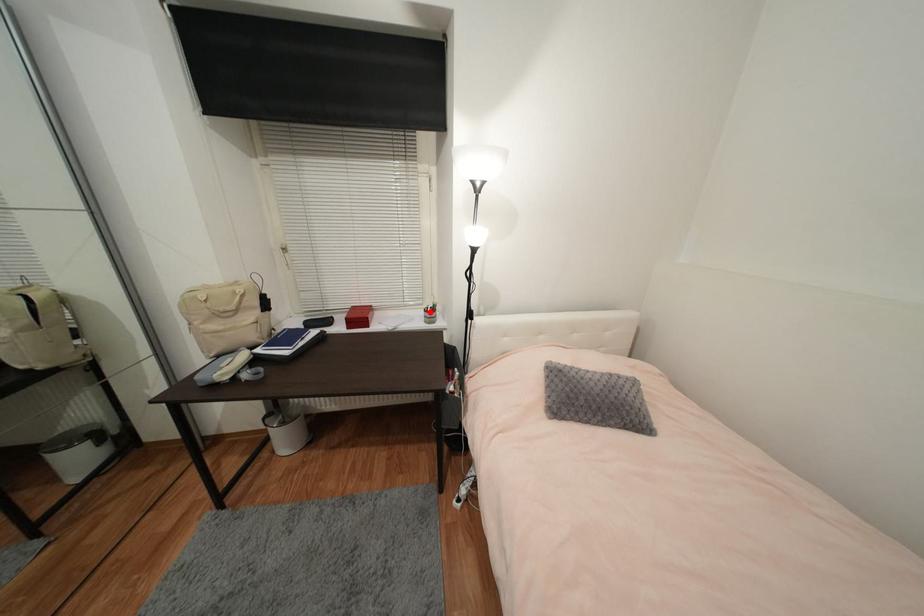
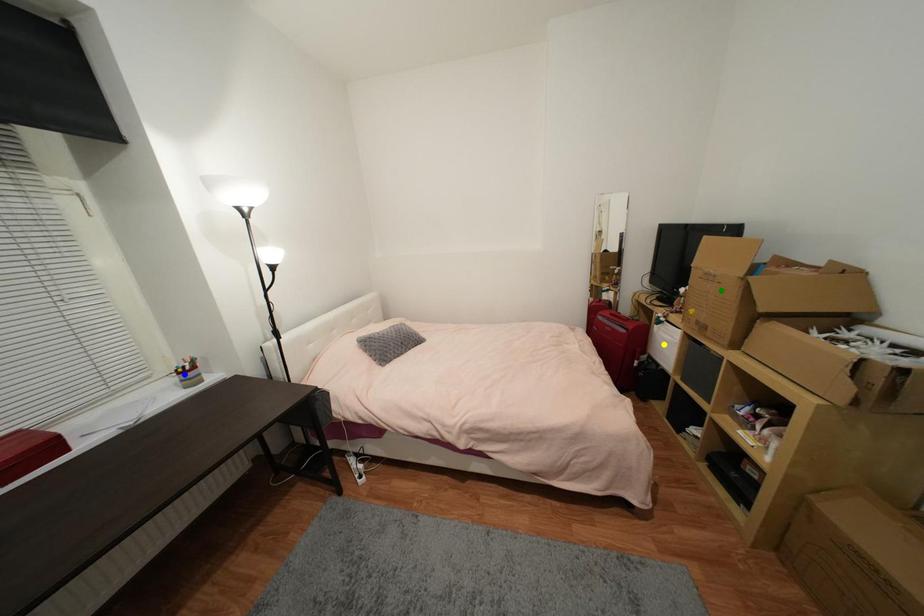
Question: I am providing you with two images of the same scene from different viewpoints. A red point is marked on the first image. You are given multiple points on the second image. In image 2, which mark is for the same physical point as the one in image 1?

Choices:
 (A) yellow point
 (B) green point
 (C) blue point

Answer: (C)